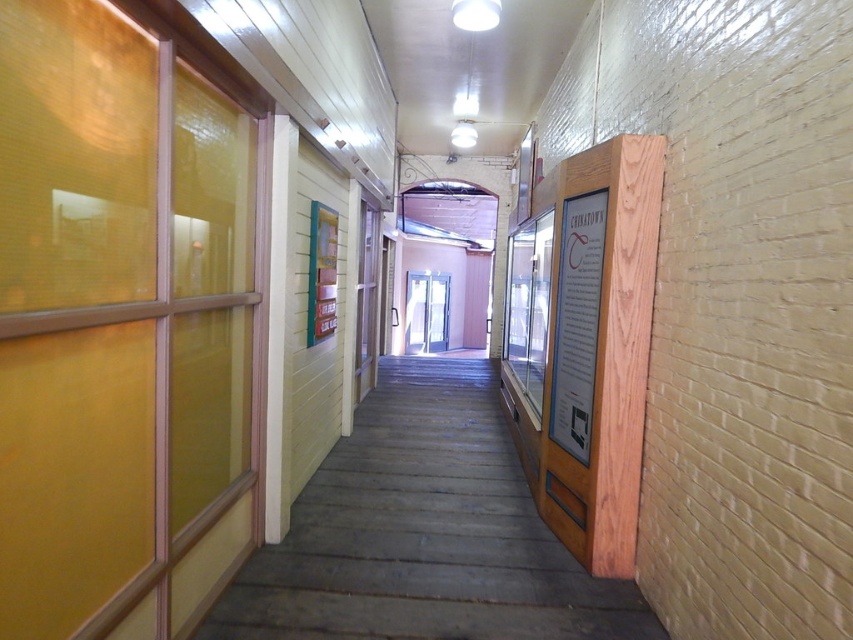
In the scene shown: You are standing in the hallway and want to reach the point marked at coordinates (306, 605). If your maximum comfortable walking distance is 10 feet, can you comfortably reach that point from your current position?

The distance between you and the point marked at coordinates (306, 605) is 8.72 feet, which is within your maximum comfortable walking distance of 10 feet. Therefore, you can comfortably reach that point.

You are a delivery person carrying a large package that is 1 meter wide. You are in the hallway and see the wooden door at center and the white glossy door at center. Which door can your package fit through?

The white glossy door at center is wider than the wooden door at center, so the package can fit through the white glossy door at center since its width is greater than 1 meter.

You are a tour guide leading a group through the hallway. You need to point out both the wooden stairs at center and the wooden door at center. Which one is shorter?

The wooden stairs at center is not as tall as the wooden door at center, so the wooden stairs at center is shorter.